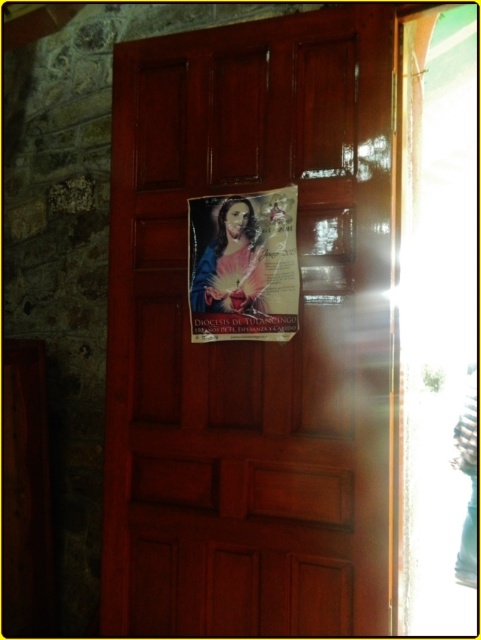
From the picture: You are standing in front of the wooden door with a poster. There is a point marked at coordinates (250,340). Based on the scene description, where is this point located?

The point at (250,340) is located on the wooden door at center because the Objects Description states that this coordinate corresponds to the wooden door at center.

You are standing in a hallway and see the wooden door at center. If you want to place a small decoration exactly at the center of the door, where should you place it?

The wooden door at center is positioned at point (250,340), so you should place the decoration at those coordinates to center it.